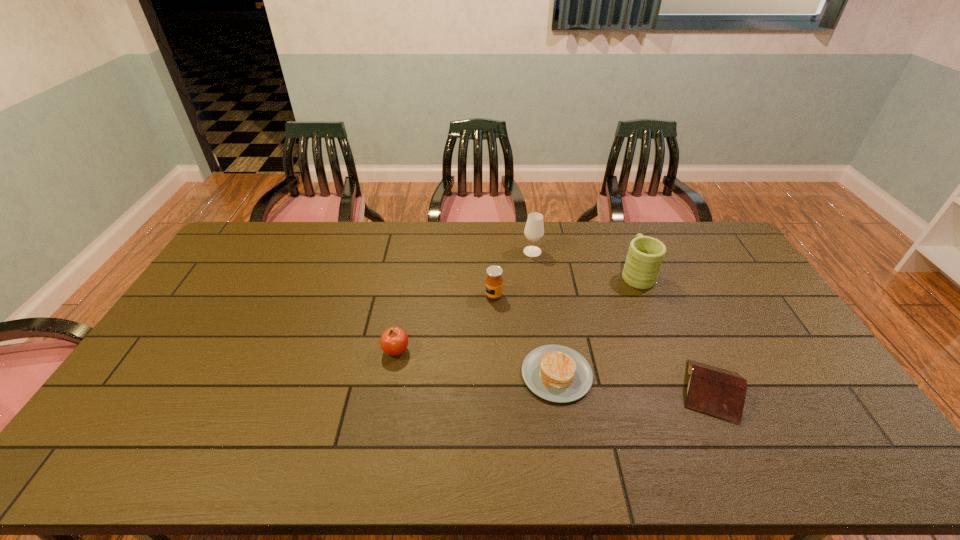
You are a GUI agent. You are given a task and a screenshot of the screen. Output one action in this format:
    pyautogui.click(x=<x>, y=<y>)
    Task: Click on the empty space between the shortest object and the mug
    
    Given the screenshot: What is the action you would take?
    pyautogui.click(x=597, y=324)

The width and height of the screenshot is (960, 540). What are the coordinates of `unoccupied position between the leftmost object and the farthest object` in the screenshot? It's located at (465, 301).

Locate an element on the screen. This screenshot has width=960, height=540. free spot between the fifth object from right to left and the apple is located at coordinates (444, 323).

Locate an element on the screen. This screenshot has width=960, height=540. the fourth closest object relative to the second object from left to right is located at coordinates (643, 262).

Identify which object is the fourth nearest to the mug. Please provide its 2D coordinates. Your answer should be formatted as a tuple, i.e. [(x, y)], where the tuple contains the x and y coordinates of a point satisfying the conditions above.

[(494, 282)]

The height and width of the screenshot is (540, 960). Identify the location of vacant position in the image that satisfies the following two spatial constraints: 1. on the front-facing side of the honey; 2. on the left side of the second shortest object. (497, 390).

The width and height of the screenshot is (960, 540). Find the location of `blank space that satisfies the following two spatial constraints: 1. on the front-facing side of the fifth object from right to left; 2. on the right side of the second shortest object`. blank space that satisfies the following two spatial constraints: 1. on the front-facing side of the fifth object from right to left; 2. on the right side of the second shortest object is located at coordinates (497, 390).

Find the location of a particular element. The image size is (960, 540). blank space that satisfies the following two spatial constraints: 1. on the front-facing side of the pancake; 2. on the left side of the second object from left to right is located at coordinates (496, 374).

Locate an element on the screen. free spot that satisfies the following two spatial constraints: 1. on the front-facing side of the fifth tallest object; 2. on the left side of the fifth object from right to left is located at coordinates (497, 390).